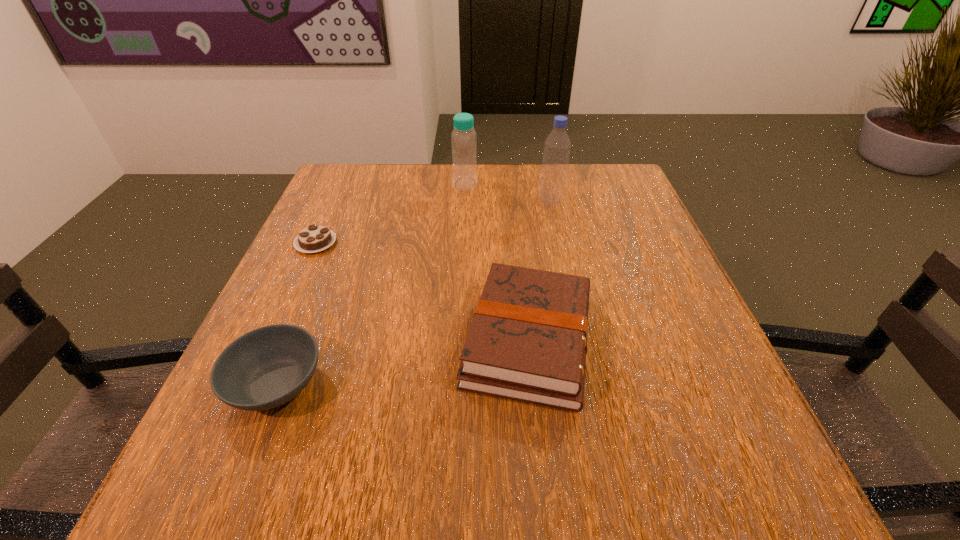
The image size is (960, 540). Identify the location of vacant region located 0.340m on the back of the hardback book. (514, 195).

At what (x,y) coordinates should I click in order to perform the action: click on free space located on the right of the soup bowl. Please return your answer as a coordinate pair (x, y). Looking at the image, I should click on (562, 384).

Locate an element on the screen. The image size is (960, 540). vacant space located on the back of the third nearest object is located at coordinates (336, 199).

In order to click on soup bowl located at the left edge in this screenshot , I will do `click(267, 367)`.

Locate an element on the screen. This screenshot has width=960, height=540. chocolate cake located at the left edge is located at coordinates (314, 238).

Locate an element on the screen. The image size is (960, 540). free region at the far edge of the desktop is located at coordinates (433, 168).

Where is `free space at the near edge`? The image size is (960, 540). free space at the near edge is located at coordinates click(352, 461).

Where is `vacant space at the left edge`? vacant space at the left edge is located at coordinates (334, 221).

Identify the location of blank space at the right edge of the desktop. The image size is (960, 540). (602, 255).

This screenshot has width=960, height=540. In order to click on free point at the far right corner in this screenshot , I will do `click(610, 199)`.